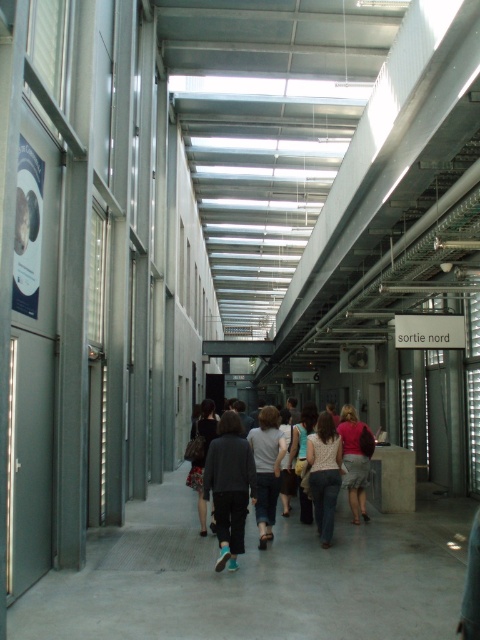
From the picture: Does patterned fabric blouse at center have a larger size compared to light gray cotton shirt at center?

Incorrect, patterned fabric blouse at center is not larger than light gray cotton shirt at center.

Does patterned fabric blouse at center appear under light gray cotton shirt at center?

Yes.

Measure the distance between patterned fabric blouse at center and camera.

patterned fabric blouse at center is 7.60 meters from camera.

I want to click on patterned fabric blouse at center, so click(x=324, y=474).

Does dark gray pants at center lie behind light gray cotton shirt at center?

No, it is not.

Does dark gray pants at center have a lesser width compared to light gray cotton shirt at center?

No, dark gray pants at center is not thinner than light gray cotton shirt at center.

Does point (222, 518) lie in front of point (274, 419)?

Yes, point (222, 518) is closer to viewer.

Image resolution: width=480 pixels, height=640 pixels. Find the location of `dark gray pants at center`. dark gray pants at center is located at coordinates (241, 481).

Is dark gray sweater at center to the right of matte pink shirt at center from the viewer's perspective?

In fact, dark gray sweater at center is to the left of matte pink shirt at center.

Can you confirm if dark gray sweater at center is wider than matte pink shirt at center?

Indeed, dark gray sweater at center has a greater width compared to matte pink shirt at center.

Identify the location of dark gray sweater at center. The width and height of the screenshot is (480, 640). (229, 486).